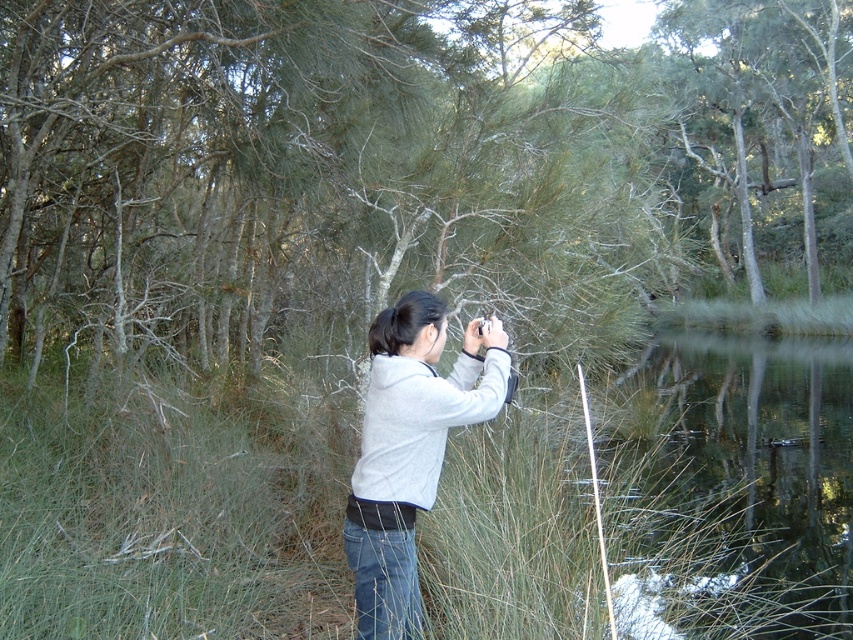
Question: Is green grass at center behind clear water at lower right?

Choices:
 (A) yes
 (B) no

Answer: (B)

Question: Is the position of green grass at center less distant than that of clear water at lower right?

Choices:
 (A) no
 (B) yes

Answer: (B)

Question: Which of the following is the farthest from the observer?

Choices:
 (A) (364, 435)
 (B) (676, 372)

Answer: (B)

Question: Which object is closer to the camera taking this photo?

Choices:
 (A) clear water at lower right
 (B) green grass at center
 (C) gray fleece jacket at center

Answer: (C)

Question: From the image, what is the correct spatial relationship of green grass at center in relation to clear water at lower right?

Choices:
 (A) left
 (B) right

Answer: (A)

Question: Which point appears farthest from the camera in this image?

Choices:
 (A) (705, 500)
 (B) (3, 588)

Answer: (A)